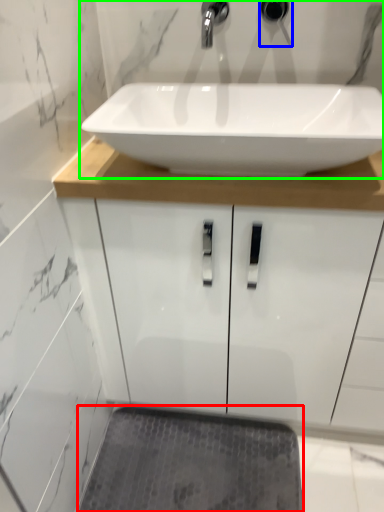
Question: Which object is the farthest from bath mat (highlighted by a red box)? Choose among these: plumbing fixture (highlighted by a blue box) or sink (highlighted by a green box).

Choices:
 (A) plumbing fixture
 (B) sink

Answer: (A)